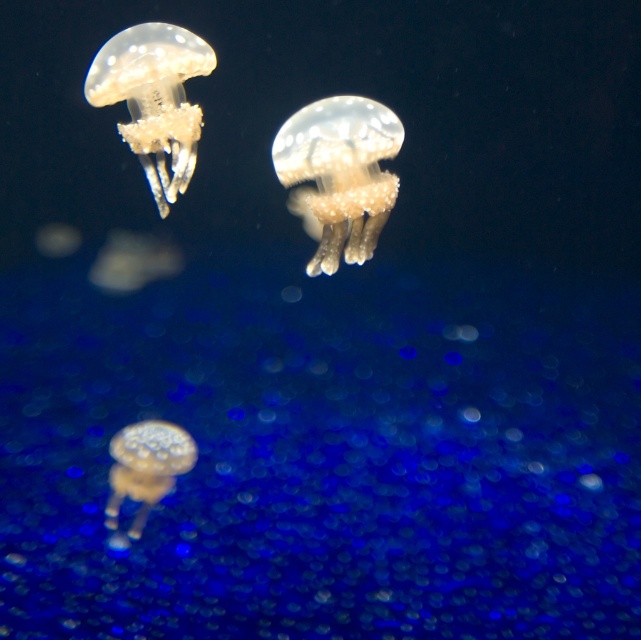
Question: From the image, what is the correct spatial relationship of translucent gelatinous at upper left in relation to translucent gelatinous at lower center?

Choices:
 (A) right
 (B) left

Answer: (A)

Question: Which is nearer to the translucent gelatinous at center?

Choices:
 (A) translucent gelatinous at upper left
 (B) translucent gelatinous at lower center

Answer: (A)

Question: Considering the relative positions of translucent gelatinous at center and translucent gelatinous at upper left in the image provided, where is translucent gelatinous at center located with respect to translucent gelatinous at upper left?

Choices:
 (A) right
 (B) left

Answer: (A)

Question: Which of the following is the closest to the observer?

Choices:
 (A) (351, 122)
 (B) (178, 474)

Answer: (A)

Question: Is translucent gelatinous at upper left to the left of translucent gelatinous at lower center from the viewer's perspective?

Choices:
 (A) yes
 (B) no

Answer: (B)

Question: Which of these objects is positioned farthest from the translucent gelatinous at lower center?

Choices:
 (A) translucent gelatinous at center
 (B) translucent gelatinous at upper left

Answer: (B)